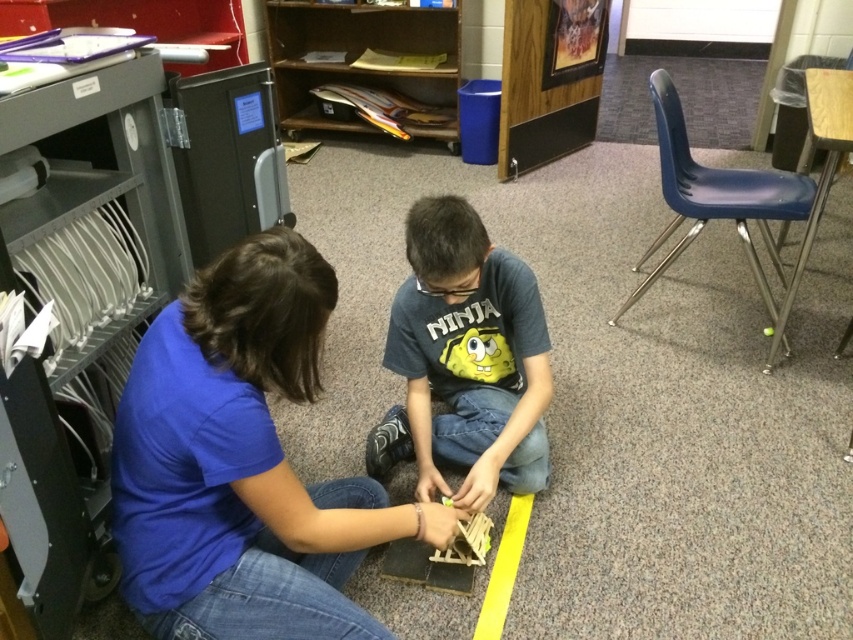
You are a photographer standing in the classroom and want to take a picture of both the blue cotton shirt at center and the gray matte shirt at center. Which shirt should you focus on first if you want to capture them from left to right?

The blue cotton shirt at center should be focused on first since it is positioned on the left side of the gray matte shirt at center, so from left to right, it comes first.